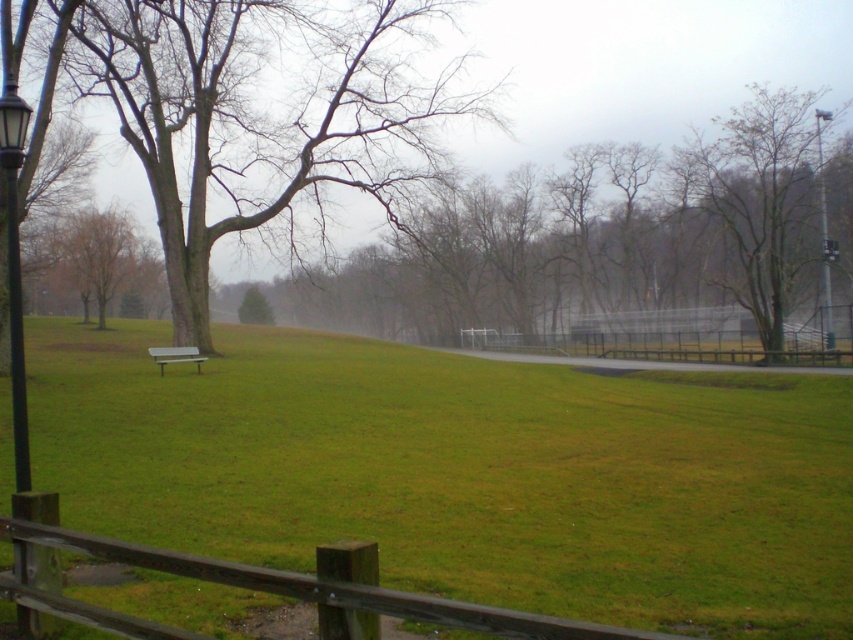
Is brown bark tree at left above bare branches at center?

Yes.

Between brown bark tree at left and bare branches at center, which one appears on the right side from the viewer's perspective?

From the viewer's perspective, bare branches at center appears more on the right side.

Between point (289, 1) and point (532, 228), which one is positioned behind?

Positioned behind is point (532, 228).

Where is `brown bark tree at left`? Image resolution: width=853 pixels, height=640 pixels. brown bark tree at left is located at coordinates (260, 112).

Does green grassy field at center appear on the right side of bare branches at center?

In fact, green grassy field at center is to the left of bare branches at center.

Between green grassy field at center and bare branches at center, which one appears on the left side from the viewer's perspective?

From the viewer's perspective, green grassy field at center appears more on the left side.

What do you see at coordinates (463, 472) in the screenshot?
I see `green grassy field at center` at bounding box center [463, 472].

Where is `green grassy field at center`? This screenshot has width=853, height=640. green grassy field at center is located at coordinates (463, 472).

Who is positioned more to the left, bare branches at center or black metal lamp post at left?

black metal lamp post at left

Describe the element at coordinates (601, 241) in the screenshot. I see `bare branches at center` at that location.

Measure the distance between point (x=543, y=300) and camera.

Point (x=543, y=300) and camera are 92.11 meters apart from each other.

This screenshot has width=853, height=640. I want to click on bare branches at center, so click(601, 241).